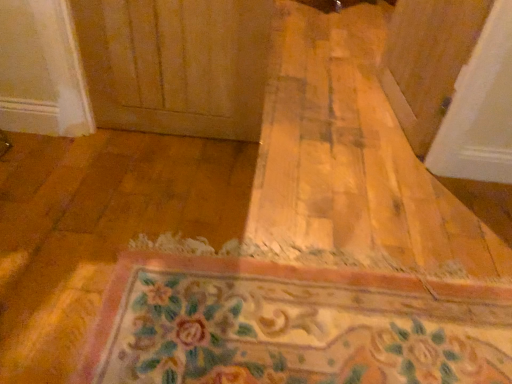
In order to click on vacant region to the left of floral carpet at center in this screenshot , I will do `click(88, 228)`.